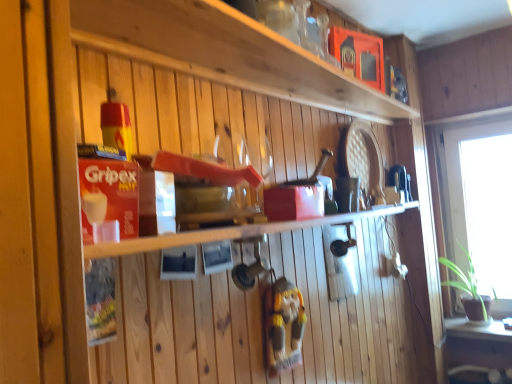
Question: Is transparent glass window at right wider or thinner than green matte table at lower right?

Choices:
 (A) wide
 (B) thin

Answer: (B)

Question: From a real-world perspective, is transparent glass window at right physically located above or below green matte table at lower right?

Choices:
 (A) below
 (B) above

Answer: (B)

Question: Estimate the real-world distances between objects in this image. Which object is farther from the green matte table at lower right?

Choices:
 (A) wooden gnome at center
 (B) matte wooden shelf at upper center, acting as the 1th shelf starting from the top
 (C) wooden shelf at center, which appears as the first shelf when ordered from the bottom
 (D) transparent glass window at right

Answer: (B)

Question: Estimate the real-world distances between objects in this image. Which object is closer to the wooden shelf at center, which appears as the first shelf when ordered from the bottom?

Choices:
 (A) transparent glass window at right
 (B) green matte table at lower right
 (C) matte wooden shelf at upper center, which is the second shelf in bottom-to-top order
 (D) wooden gnome at center

Answer: (D)